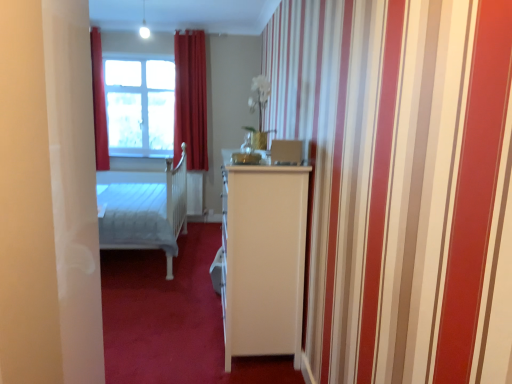
Question: Should I look upward or downward to see velvet red curtain at center?

Choices:
 (A) down
 (B) up

Answer: (B)

Question: Is velvet red curtain at center to the right of white glass window at upper center from the viewer's perspective?

Choices:
 (A) yes
 (B) no

Answer: (A)

Question: From the image's perspective, is velvet red curtain at center beneath white glass window at upper center?

Choices:
 (A) yes
 (B) no

Answer: (A)

Question: From a real-world perspective, is velvet red curtain at center over white glass window at upper center?

Choices:
 (A) yes
 (B) no

Answer: (A)

Question: Is velvet red curtain at center far away from white glass window at upper center?

Choices:
 (A) no
 (B) yes

Answer: (A)

Question: Is white glass window at upper center surrounded by velvet red curtain at center?

Choices:
 (A) yes
 (B) no

Answer: (B)

Question: Is velvet red curtain at center further to camera compared to white glass window at upper center?

Choices:
 (A) yes
 (B) no

Answer: (B)

Question: Considering the relative sizes of white glass window at upper center and velvet red curtain at center in the image provided, is white glass window at upper center shorter than velvet red curtain at center?

Choices:
 (A) no
 (B) yes

Answer: (B)

Question: Does white glass window at upper center have a greater height compared to velvet red curtain at center?

Choices:
 (A) yes
 (B) no

Answer: (B)

Question: Does white glass window at upper center have a larger size compared to velvet red curtain at center?

Choices:
 (A) no
 (B) yes

Answer: (A)

Question: From the image's perspective, is white glass window at upper center located beneath velvet red curtain at center?

Choices:
 (A) yes
 (B) no

Answer: (B)

Question: Does white glass window at upper center have a smaller size compared to velvet red curtain at center?

Choices:
 (A) yes
 (B) no

Answer: (A)

Question: Is white glass window at upper center behind velvet red curtain at center?

Choices:
 (A) no
 (B) yes

Answer: (B)

Question: Is velvet red curtain at center situated inside white glass window at upper center or outside?

Choices:
 (A) inside
 (B) outside

Answer: (B)